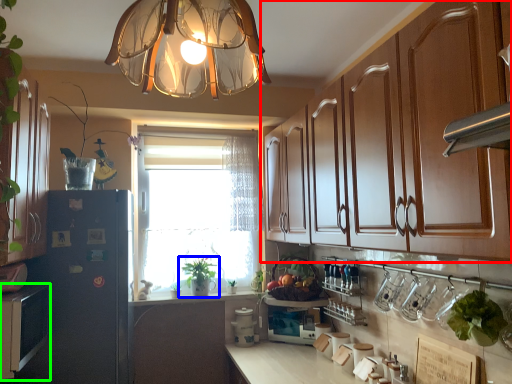
Question: Estimate the real-world distances between objects in this image. Which object is closer to cabinetry (highlighted by a red box), houseplant (highlighted by a blue box) or cabinetry (highlighted by a green box)?

Choices:
 (A) houseplant
 (B) cabinetry

Answer: (A)